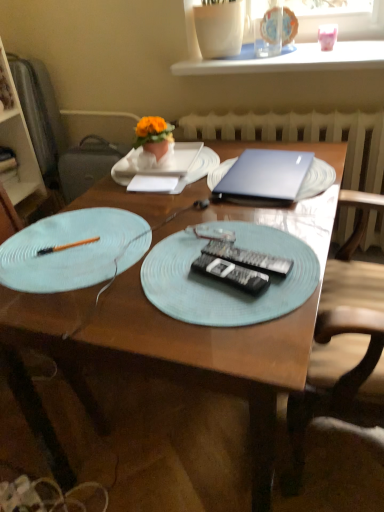
You are a GUI agent. You are given a task and a screenshot of the screen. Output one action in this format:
    pyautogui.click(x=<x>, y=<y>)
    Task: Click on the empty space that is in between orange fabric flower at upper center and black plastic remote control at center, placed as the 2th remote control when sorted from bottom to top
    The height and width of the screenshot is (512, 384).
    Given the screenshot: What is the action you would take?
    pyautogui.click(x=198, y=211)